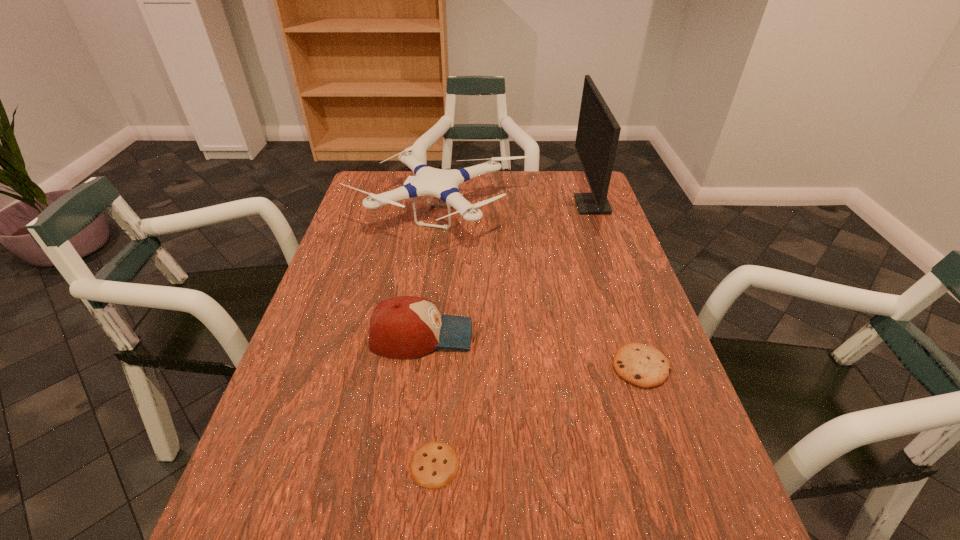
Where is `blank space located 0.130m on the right of the drone`? The width and height of the screenshot is (960, 540). blank space located 0.130m on the right of the drone is located at coordinates (570, 214).

At what (x,y) coordinates should I click in order to perform the action: click on vacant space located on the front-facing side of the baseball cap. Please return your answer as a coordinate pair (x, y). The width and height of the screenshot is (960, 540). Looking at the image, I should click on (595, 336).

At what (x,y) coordinates should I click in order to perform the action: click on blank space located on the front of the second shortest object. Please return your answer as a coordinate pair (x, y). Image resolution: width=960 pixels, height=540 pixels. Looking at the image, I should click on (656, 411).

Locate an element on the screen. vacant region located 0.380m on the right of the left cookie is located at coordinates (673, 464).

Find the location of a particular element. computer monitor that is positioned at the far edge is located at coordinates (598, 131).

Image resolution: width=960 pixels, height=540 pixels. Identify the location of drone located at the far edge. (444, 184).

What are the coordinates of `drone that is positioned at the left edge` in the screenshot? It's located at (444, 184).

You are a GUI agent. You are given a task and a screenshot of the screen. Output one action in this format:
    pyautogui.click(x=<x>, y=<y>)
    Task: Click on the baseball cap positioned at the left edge
    The width and height of the screenshot is (960, 540).
    Given the screenshot: What is the action you would take?
    pyautogui.click(x=405, y=326)

Identify the location of computer monitor at the right edge. (598, 131).

Where is `cookie that is at the right edge`? The height and width of the screenshot is (540, 960). cookie that is at the right edge is located at coordinates (644, 366).